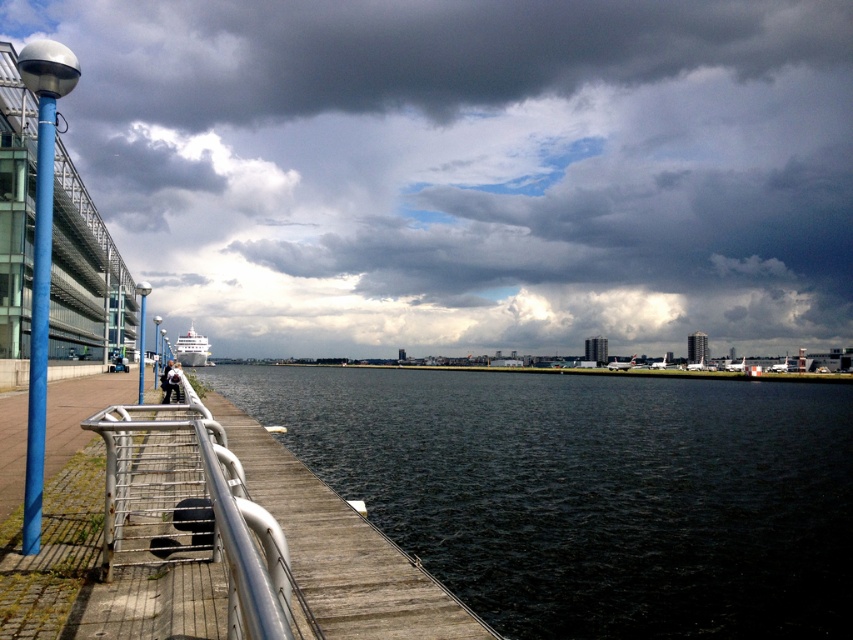
You are standing at the wooden walkway and see two points in the scene. The first point is at coordinate point(222, 64) and the second is at point(633, 618). Which point is closer to you?

Point(633, 618) is closer to you because point(222, 64) is behind it.

You are standing on the wooden walkway and looking towards the water. Which object, the dark gray cloud at upper center or the dark water at center, is higher in the sky?

The dark gray cloud at upper center is higher in the sky than the dark water at center because it is taller.